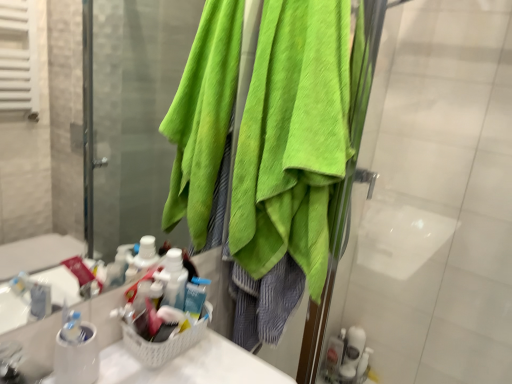
Question: Is translucent plastic soap dispenser at lower right, arranged as the 2th toiletry when viewed from the right, in front of or behind white glossy toothbrush at lower right, the second toiletry when ordered from left to right, in the image?

Choices:
 (A) front
 (B) behind

Answer: (A)

Question: Based on their sizes in the image, would you say translucent plastic soap dispenser at lower right, arranged as the 2th toiletry when viewed from the right, is bigger or smaller than white glossy toothbrush at lower right, the second toiletry when ordered from left to right?

Choices:
 (A) big
 (B) small

Answer: (B)

Question: Which of these objects is positioned farthest from the white glossy toothbrush at lower right, the second toiletry when ordered from left to right?

Choices:
 (A) translucent plastic soap dispenser at lower right, the first toiletry viewed from the left
 (B) green towel at upper right

Answer: (B)

Question: Which object is the farthest from the green towel at upper right?

Choices:
 (A) white glossy toothbrush at lower right, which appears as the first toiletry when viewed from the right
 (B) translucent plastic soap dispenser at lower right, the first toiletry viewed from the left

Answer: (B)